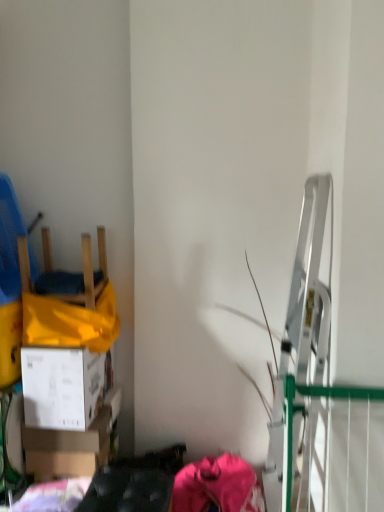
What is the approximate width of pink fabric at lower center?

20.43 inches.

What do you see at coordinates (217, 486) in the screenshot? This screenshot has width=384, height=512. I see `pink fabric at lower center` at bounding box center [217, 486].

Where is `wooden chair at left`? This screenshot has height=512, width=384. wooden chair at left is located at coordinates (9, 241).

The height and width of the screenshot is (512, 384). What do you see at coordinates (67, 449) in the screenshot? I see `white cardboard box at lower left, arranged as the second box when viewed from the top` at bounding box center [67, 449].

Locate an element on the screen. The width and height of the screenshot is (384, 512). white cardboard box at lower left, which appears as the 1th box when viewed from the top is located at coordinates (64, 386).

Based on their positions, is wooden chair at left located to the left or right of white cardboard box at lower left, which appears as the 1th box when viewed from the top?

In the image, wooden chair at left appears on the left side of white cardboard box at lower left, which appears as the 1th box when viewed from the top.

Considering the relative sizes of wooden chair at left and white cardboard box at lower left, placed as the second box when sorted from bottom to top, in the image provided, is wooden chair at left taller than white cardboard box at lower left, placed as the second box when sorted from bottom to top,?

No.

Which is closer to the camera, (12, 211) or (57, 426)?

The point (57, 426) is in front.

From a real-world perspective, is wooden chair at left over white cardboard box at lower left, placed as the second box when sorted from bottom to top?

Yes, from a real-world perspective, wooden chair at left is on top of white cardboard box at lower left, placed as the second box when sorted from bottom to top.

Measure the distance between wooden chair at left and white cardboard box at lower left, arranged as the second box when viewed from the top.

A distance of 76.24 centimeters exists between wooden chair at left and white cardboard box at lower left, arranged as the second box when viewed from the top.

Is point (13, 197) more distant than point (34, 475)?

Yes, it is behind point (34, 475).

Is wooden chair at left turned away from white cardboard box at lower left, arranged as the second box when viewed from the top?

No.

From the image's perspective, which one is positioned higher, wooden chair at left or white cardboard box at lower left, which is the first box in bottom-to-top order?

wooden chair at left appears higher in the image.

Are white cardboard box at lower left, placed as the second box when sorted from bottom to top, and wooden chair at left located far from each other?

No, white cardboard box at lower left, placed as the second box when sorted from bottom to top, is not far from wooden chair at left.

Which is behind, point (75, 408) or point (7, 284)?

The point (7, 284) is behind.

This screenshot has width=384, height=512. Identify the location of chair on the left of white cardboard box at lower left, placed as the second box when sorted from bottom to top. (9, 241).

From a real-world perspective, which object rests below the other?

From a 3D spatial view, pink fabric at lower center is below.

Which is more to the left, white cardboard box at lower left, which is the first box in bottom-to-top order, or pink fabric at lower center?

Positioned to the left is white cardboard box at lower left, which is the first box in bottom-to-top order.

In the image, there is a white cardboard box at lower left, which is the first box in bottom-to-top order. What are the coordinates of `clothing below it (from the image's perspective)` in the screenshot? It's located at (217, 486).

From a real-world perspective, which object stands above the other?

From a 3D spatial view, wooden chair at left is above.

Looking at this image, considering the sizes of objects white cardboard box at lower left, which is the first box in bottom-to-top order, and wooden chair at left in the image provided, who is shorter, white cardboard box at lower left, which is the first box in bottom-to-top order, or wooden chair at left?

With less height is white cardboard box at lower left, which is the first box in bottom-to-top order.

Is there a large distance between white cardboard box at lower left, which is the first box in bottom-to-top order, and wooden chair at left?

No, white cardboard box at lower left, which is the first box in bottom-to-top order, is not far away from wooden chair at left.

Where is `box that is the 2nd one below the wooden chair at left (from a real-world perspective)`? This screenshot has height=512, width=384. box that is the 2nd one below the wooden chair at left (from a real-world perspective) is located at coordinates click(67, 449).

From the image's perspective, which is below, wooden chair at left or pink fabric at lower center?

pink fabric at lower center.

From the picture: Is wooden chair at left inside the boundaries of pink fabric at lower center, or outside?

wooden chair at left exists outside the volume of pink fabric at lower center.

Is wooden chair at left next to pink fabric at lower center and touching it?

wooden chair at left and pink fabric at lower center are not in contact.

Does wooden chair at left appear on the left side of pink fabric at lower center?

Yes.

Which is more to the right, white cardboard box at lower left, arranged as the second box when viewed from the top, or white cardboard box at lower left, which appears as the 1th box when viewed from the top?

white cardboard box at lower left, arranged as the second box when viewed from the top.

From the image's perspective, is white cardboard box at lower left, arranged as the second box when viewed from the top, under white cardboard box at lower left, placed as the second box when sorted from bottom to top?

Correct, white cardboard box at lower left, arranged as the second box when viewed from the top, appears lower than white cardboard box at lower left, placed as the second box when sorted from bottom to top, in the image.

Is point (41, 439) closer or farther from the camera than point (46, 419)?

Point (41, 439) is farther from the camera than point (46, 419).

Find the location of a particular element. Image resolution: width=384 pixels, height=512 pixels. chair above the white cardboard box at lower left, which appears as the 1th box when viewed from the top (from a real-world perspective) is located at coordinates (9, 241).

Locate an element on the screen. chair above the white cardboard box at lower left, arranged as the second box when viewed from the top (from the image's perspective) is located at coordinates (9, 241).

Which object lies further to the anchor point white cardboard box at lower left, arranged as the second box when viewed from the top, white cardboard box at lower left, placed as the second box when sorted from bottom to top, or pink fabric at lower center?

pink fabric at lower center is further to white cardboard box at lower left, arranged as the second box when viewed from the top.

Estimate the real-world distances between objects in this image. Which object is closer to pink fabric at lower center, wooden chair at left or white cardboard box at lower left, arranged as the second box when viewed from the top?

Based on the image, white cardboard box at lower left, arranged as the second box when viewed from the top, appears to be nearer to pink fabric at lower center.

Based on their spatial positions, is white cardboard box at lower left, which appears as the 1th box when viewed from the top, or pink fabric at lower center closer to wooden chair at left?

Among the two, white cardboard box at lower left, which appears as the 1th box when viewed from the top, is located nearer to wooden chair at left.

Considering their positions, is wooden chair at left positioned closer to white cardboard box at lower left, which is the first box in bottom-to-top order, than white cardboard box at lower left, placed as the second box when sorted from bottom to top?

Among the two, white cardboard box at lower left, placed as the second box when sorted from bottom to top, is located nearer to white cardboard box at lower left, which is the first box in bottom-to-top order.

Which object lies nearer to the anchor point white cardboard box at lower left, which appears as the 1th box when viewed from the top, pink fabric at lower center or white cardboard box at lower left, arranged as the second box when viewed from the top?

Among the two, white cardboard box at lower left, arranged as the second box when viewed from the top, is located nearer to white cardboard box at lower left, which appears as the 1th box when viewed from the top.

When comparing their distances from pink fabric at lower center, does wooden chair at left or white cardboard box at lower left, placed as the second box when sorted from bottom to top, seem further?

The object further to pink fabric at lower center is wooden chair at left.

Estimate the real-world distances between objects in this image. Which object is further from pink fabric at lower center, white cardboard box at lower left, which is the first box in bottom-to-top order, or white cardboard box at lower left, placed as the second box when sorted from bottom to top?

The object further to pink fabric at lower center is white cardboard box at lower left, placed as the second box when sorted from bottom to top.

From the image, which object appears to be farther from white cardboard box at lower left, placed as the second box when sorted from bottom to top, wooden chair at left or white cardboard box at lower left, which is the first box in bottom-to-top order?

wooden chair at left is positioned further to the anchor white cardboard box at lower left, placed as the second box when sorted from bottom to top.

At what (x,y) coordinates should I click in order to perform the action: click on box between wooden chair at left and white cardboard box at lower left, which is the first box in bottom-to-top order, in the up-down direction. Please return your answer as a coordinate pair (x, y). Looking at the image, I should click on (64, 386).

Where is `box situated between white cardboard box at lower left, which appears as the 1th box when viewed from the top, and pink fabric at lower center from left to right`? box situated between white cardboard box at lower left, which appears as the 1th box when viewed from the top, and pink fabric at lower center from left to right is located at coordinates tap(67, 449).